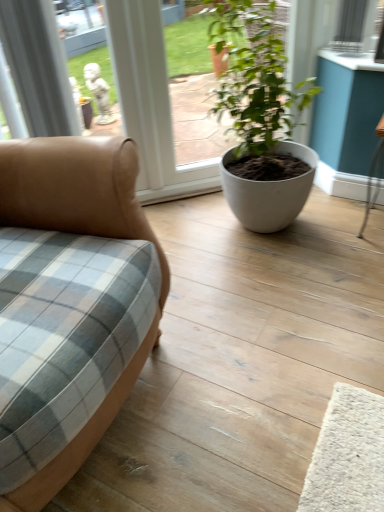
This screenshot has height=512, width=384. What do you see at coordinates (81, 232) in the screenshot? I see `tan leather couch at left` at bounding box center [81, 232].

The image size is (384, 512). I want to click on tan leather couch at left, so (81, 232).

The height and width of the screenshot is (512, 384). Describe the element at coordinates (261, 119) in the screenshot. I see `white matte pot at center` at that location.

You are a GUI agent. You are given a task and a screenshot of the screen. Output one action in this format:
    pyautogui.click(x=<x>, y=<y>)
    Task: Click on the white matte pot at center
    This screenshot has width=384, height=512.
    Given the screenshot: What is the action you would take?
    pyautogui.click(x=261, y=119)

Locate an element on the screen. tan leather couch at left is located at coordinates (81, 232).

Does white matte pot at center appear on the right side of tan leather couch at left?

Yes, white matte pot at center is to the right of tan leather couch at left.

Which object is further away from the camera, white matte pot at center or tan leather couch at left?

white matte pot at center.

Is point (248, 50) farther from viewer compared to point (118, 219)?

Yes, it is.

From the image's perspective, is white matte pot at center under tan leather couch at left?

No, from the image's perspective, white matte pot at center is not beneath tan leather couch at left.

From a real-world perspective, relative to tan leather couch at left, is white matte pot at center vertically above or below?

white matte pot at center is situated lower than tan leather couch at left in the real world.

Is white matte pot at center wider or thinner than tan leather couch at left?

In the image, white matte pot at center appears to be more narrow than tan leather couch at left.

Between white matte pot at center and tan leather couch at left, which one has more height?

tan leather couch at left.

Considering the sizes of objects white matte pot at center and tan leather couch at left in the image provided, who is bigger, white matte pot at center or tan leather couch at left?

Bigger between the two is tan leather couch at left.

Is white matte pot at center surrounding tan leather couch at left?

No, tan leather couch at left is not a part of white matte pot at center.

Is white matte pot at center positioned far away from tan leather couch at left?

white matte pot at center is near tan leather couch at left, not far away.

Based on the photo, does white matte pot at center turn towards tan leather couch at left?

No, white matte pot at center is not aimed at tan leather couch at left.

How many degrees apart are the facing directions of white matte pot at center and tan leather couch at left?

The facing directions of white matte pot at center and tan leather couch at left are 40 degrees apart.

Find the location of a particular element. This screenshot has width=384, height=512. houseplant located underneath the tan leather couch at left (from a real-world perspective) is located at coordinates (261, 119).

Between tan leather couch at left and white matte pot at center, which one appears on the left side from the viewer's perspective?

tan leather couch at left is more to the left.

Is tan leather couch at left in front of or behind white matte pot at center in the image?

tan leather couch at left is in front of white matte pot at center.

Does point (41, 215) appear closer or farther from the camera than point (288, 128)?

Point (41, 215) appears to be closer to the viewer than point (288, 128).

Looking at this image, from the image's perspective, is tan leather couch at left beneath white matte pot at center?

Yes, from the image's perspective, tan leather couch at left is below white matte pot at center.

From a real-world perspective, between tan leather couch at left and white matte pot at center, who is vertically higher?

tan leather couch at left is physically above.

Based on the photo, considering the sizes of objects tan leather couch at left and white matte pot at center in the image provided, who is wider, tan leather couch at left or white matte pot at center?

tan leather couch at left.

Does tan leather couch at left have a lesser height compared to white matte pot at center?

No.

Considering the sizes of objects tan leather couch at left and white matte pot at center in the image provided, who is smaller, tan leather couch at left or white matte pot at center?

Smaller between the two is white matte pot at center.

Looking at this image, can we say tan leather couch at left lies outside white matte pot at center?

Absolutely, tan leather couch at left is external to white matte pot at center.

Does tan leather couch at left touch white matte pot at center?

tan leather couch at left is not next to white matte pot at center, and they're not touching.

Does tan leather couch at left turn towards white matte pot at center?

No, tan leather couch at left does not turn towards white matte pot at center.

How different are the orientations of tan leather couch at left and white matte pot at center in degrees?

The facing directions of tan leather couch at left and white matte pot at center are 40 degrees apart.

The width and height of the screenshot is (384, 512). What are the coordinates of `houseplant above the tan leather couch at left (from the image's perspective)` in the screenshot? It's located at (261, 119).

Where is `houseplant located above the tan leather couch at left (from the image's perspective)`? The image size is (384, 512). houseplant located above the tan leather couch at left (from the image's perspective) is located at coordinates (261, 119).

You are a GUI agent. You are given a task and a screenshot of the screen. Output one action in this format:
    pyautogui.click(x=<x>, y=<y>)
    Task: Click on the houseplant located underneath the tan leather couch at left (from a real-world perspective)
    
    Given the screenshot: What is the action you would take?
    pyautogui.click(x=261, y=119)